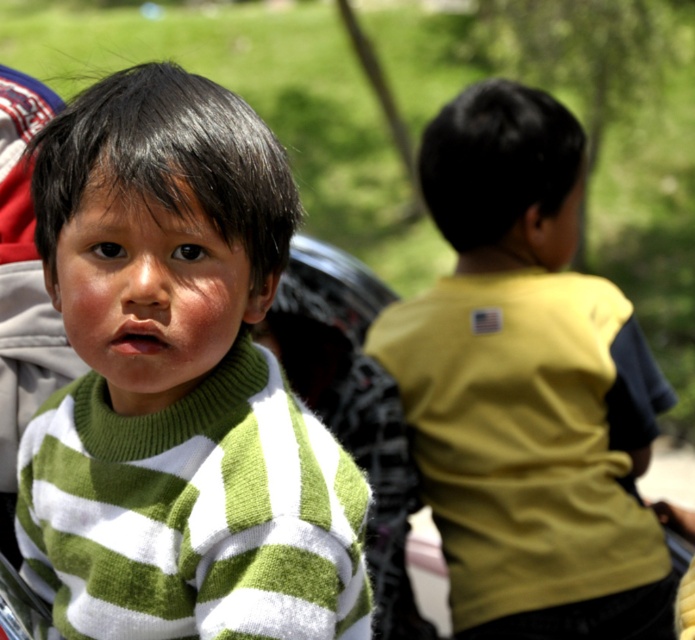
Question: From the image, what is the correct spatial relationship of green striped sweater at center in relation to yellow matte shirt at right?

Choices:
 (A) below
 (B) above

Answer: (B)

Question: Can you confirm if green striped sweater at center is bigger than yellow matte shirt at right?

Choices:
 (A) yes
 (B) no

Answer: (B)

Question: Among these objects, which one is farthest from the camera?

Choices:
 (A) yellow matte shirt at right
 (B) green striped sweater at center

Answer: (A)

Question: Can you confirm if green striped sweater at center is bigger than yellow matte shirt at right?

Choices:
 (A) no
 (B) yes

Answer: (A)